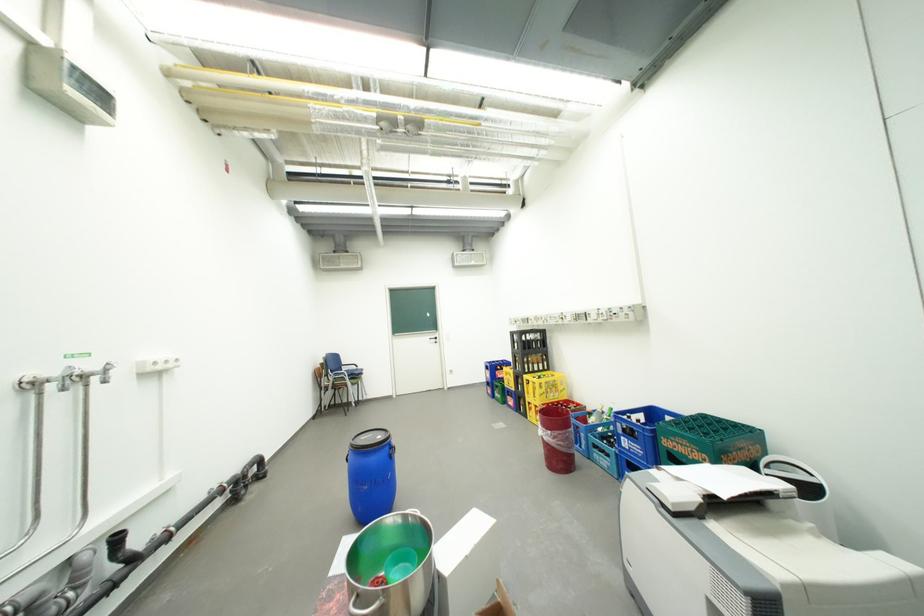
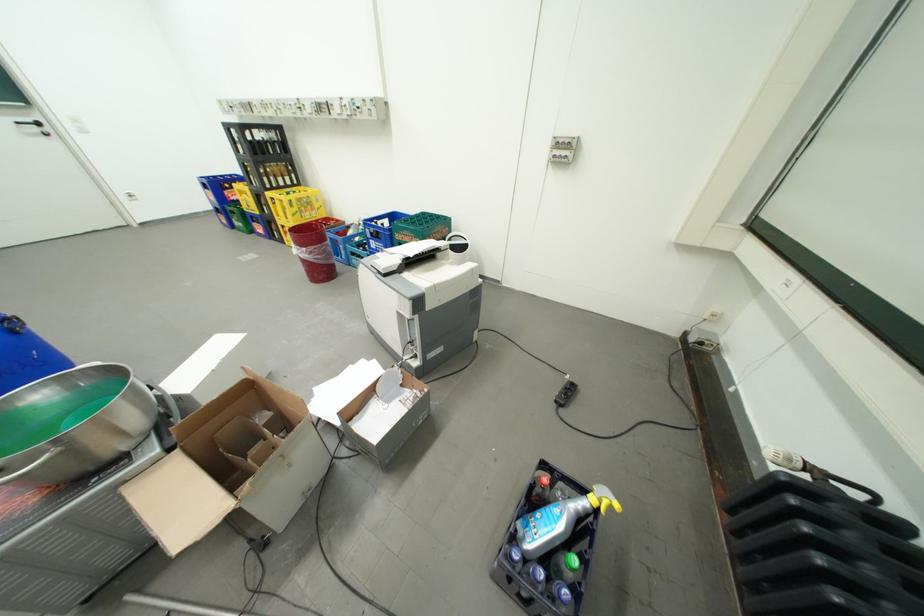
The point at (708, 451) is marked in the first image. Where is the corresponding point in the second image?

(424, 238)